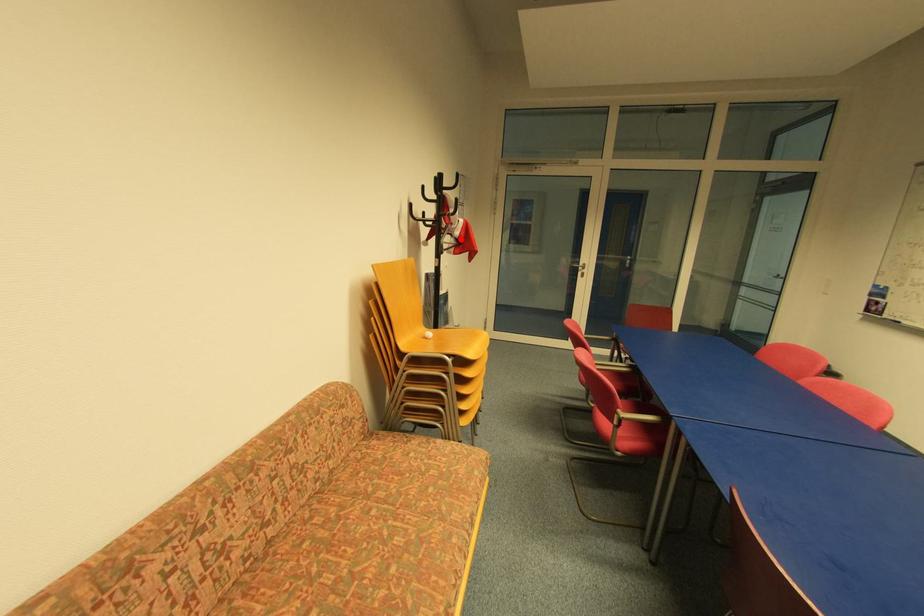
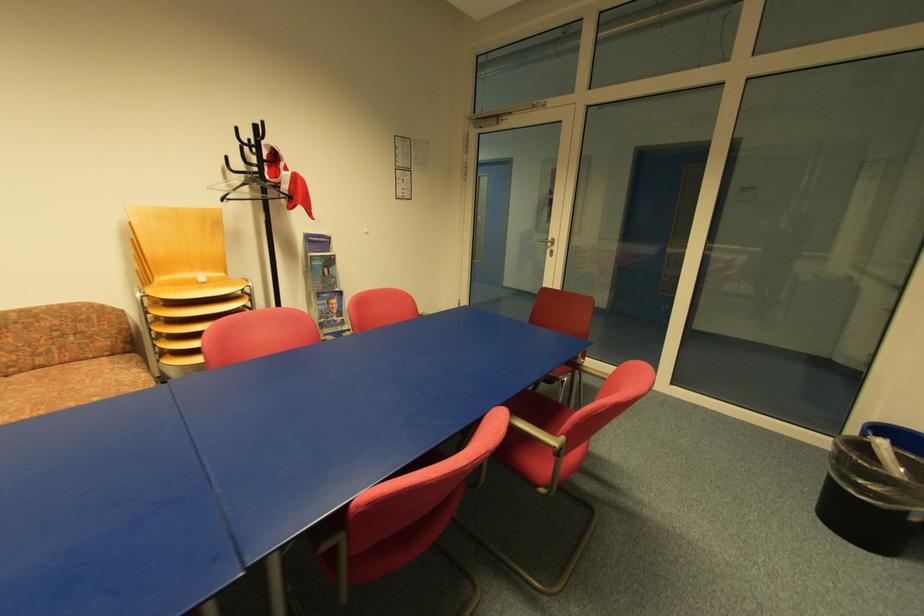
In the second image, find the point that corresponds to the highlighted location in the first image.

(292, 193)